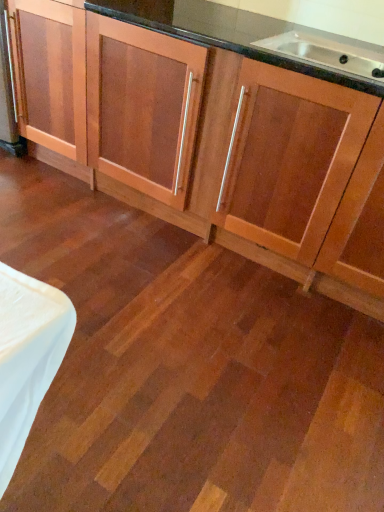
This screenshot has height=512, width=384. What do you see at coordinates (221, 144) in the screenshot?
I see `wooden cabinet at center` at bounding box center [221, 144].

Measure the distance between point (208,106) and camera.

Point (208,106) and camera are 1.70 meters apart from each other.

The image size is (384, 512). Identify the location of wooden cabinet at center. (221, 144).

What is the approximate height of wooden cabinet at center?

It is 3.71 feet.

Find the location of `wooden cabinet at center`. wooden cabinet at center is located at coordinates click(x=221, y=144).